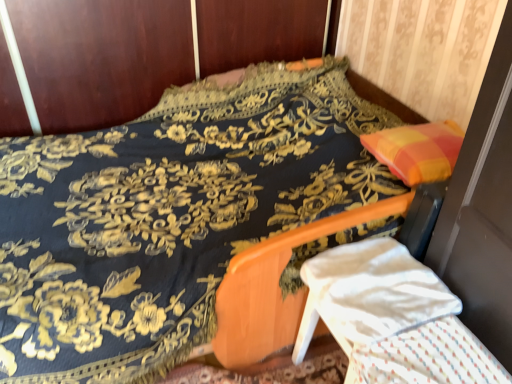
Question: From a real-world perspective, is white fabric armchair at lower right physically located above or below white textured blanket at lower right?

Choices:
 (A) below
 (B) above

Answer: (A)

Question: Considering the positions of white fabric armchair at lower right and white textured blanket at lower right in the image, is white fabric armchair at lower right bigger or smaller than white textured blanket at lower right?

Choices:
 (A) small
 (B) big

Answer: (B)

Question: In terms of height, does white fabric armchair at lower right look taller or shorter compared to white textured blanket at lower right?

Choices:
 (A) short
 (B) tall

Answer: (B)

Question: Is white textured blanket at lower right taller or shorter than white fabric armchair at lower right?

Choices:
 (A) tall
 (B) short

Answer: (B)

Question: In the image, is white textured blanket at lower right positioned in front of or behind white fabric armchair at lower right?

Choices:
 (A) behind
 (B) front

Answer: (B)

Question: From a real-world perspective, relative to white fabric armchair at lower right, is white textured blanket at lower right vertically above or below?

Choices:
 (A) below
 (B) above

Answer: (B)

Question: In terms of size, does white textured blanket at lower right appear bigger or smaller than white fabric armchair at lower right?

Choices:
 (A) small
 (B) big

Answer: (A)